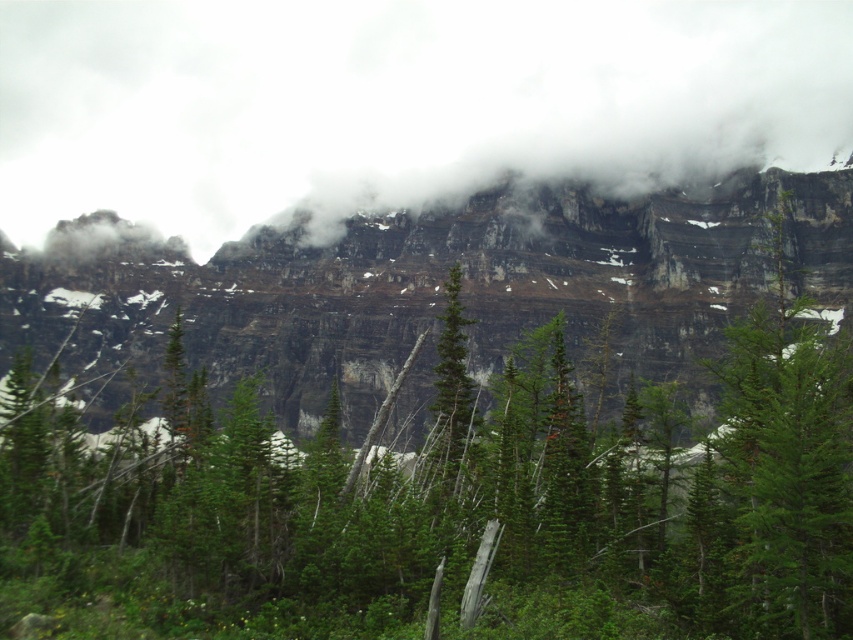
Question: Where is white fluffy cloud at upper center located in relation to rocky cliff at upper center in the image?

Choices:
 (A) left
 (B) right

Answer: (B)

Question: Is white fluffy cloud at upper center smaller than rocky cliff at upper center?

Choices:
 (A) yes
 (B) no

Answer: (B)

Question: Is white fluffy cloud at upper center to the right of rocky cliff at upper center from the viewer's perspective?

Choices:
 (A) no
 (B) yes

Answer: (B)

Question: Among these points, which one is nearest to the camera?

Choices:
 (A) (418, 92)
 (B) (316, 356)

Answer: (B)